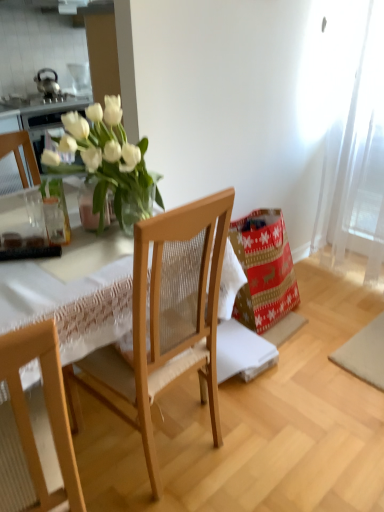
I want to click on clear glass vase at left, so click(55, 212).

Find the location of a particular element. The image size is (384, 512). wooden chair at center is located at coordinates (169, 317).

What is the approximate width of wooden chair at center?

17.62 inches.

Measure the distance between clear glass vase at center and camera.

clear glass vase at center and camera are 4.08 feet apart from each other.

You are a GUI agent. You are given a task and a screenshot of the screen. Output one action in this format:
    pyautogui.click(x=<x>, y=<y>)
    Task: Click on the clear glass vase at left
    
    Given the screenshot: What is the action you would take?
    pyautogui.click(x=55, y=212)

How far apart are wooden chair at center and red and gold paper bag at lower right?

They are 25.68 inches apart.

From a real-world perspective, which is physically below, wooden chair at center or red and gold paper bag at lower right?

From a 3D spatial view, red and gold paper bag at lower right is below.

Locate an element on the screen. Image resolution: width=384 pixels, height=512 pixels. material behind the wooden chair at center is located at coordinates (264, 271).

Are wooden chair at center and red and gold paper bag at lower right making contact?

No.

Who is bigger, clear glass vase at center or wooden chair at center?

With larger size is wooden chair at center.

Visually, is clear glass vase at center positioned to the left or to the right of wooden chair at center?

In the image, clear glass vase at center appears on the left side of wooden chair at center.

Would you consider clear glass vase at center to be distant from clear glass vase at left?

No, clear glass vase at center is not far away from clear glass vase at left.

From a real-world perspective, is clear glass vase at center on clear glass vase at left?

No, from a real-world perspective, clear glass vase at center is not over clear glass vase at left

This screenshot has width=384, height=512. I want to click on glass vase that appears on the left of clear glass vase at center, so click(x=55, y=212).

Does clear glass vase at center have a greater width compared to clear glass vase at left?

Yes, clear glass vase at center is wider than clear glass vase at left.

Would you say wooden chair at center is outside clear glass vase at center?

That's correct, wooden chair at center is outside of clear glass vase at center.

Visually, is wooden chair at center positioned to the left or to the right of clear glass vase at center?

wooden chair at center is positioned on clear glass vase at center's right side.

Which of these two, wooden chair at center or clear glass vase at center, is bigger?

With larger size is wooden chair at center.

Find the location of a particular element. This screenshot has width=384, height=512. glass vase in front of the red and gold paper bag at lower right is located at coordinates (55, 212).

From the picture: From a real-world perspective, relative to red and gold paper bag at lower right, is clear glass vase at left vertically above or below?

clear glass vase at left is above red and gold paper bag at lower right.

Considering the positions of objects clear glass vase at left and red and gold paper bag at lower right in the image provided, who is more to the left, clear glass vase at left or red and gold paper bag at lower right?

clear glass vase at left.

From the image's perspective, which one is positioned higher, clear glass vase at left or red and gold paper bag at lower right?

clear glass vase at left, from the image's perspective.

Would you consider clear glass vase at left to be distant from wooden chair at center?

No, clear glass vase at left is in close proximity to wooden chair at center.

Is clear glass vase at left positioned with its back to wooden chair at center?

Yes, wooden chair at center is at the back of clear glass vase at left.

The image size is (384, 512). Identify the location of chair directly beneath the clear glass vase at left (from a real-world perspective). (169, 317).

Which is more to the left, clear glass vase at left or wooden chair at center?

clear glass vase at left is more to the left.

Would you say clear glass vase at center is part of red and gold paper bag at lower right's contents?

No, clear glass vase at center is not a part of red and gold paper bag at lower right.

Is red and gold paper bag at lower right directly adjacent to clear glass vase at center?

No, red and gold paper bag at lower right is not touching clear glass vase at center.

Is red and gold paper bag at lower right bigger than clear glass vase at center?

Yes, red and gold paper bag at lower right is bigger than clear glass vase at center.

In terms of height, does red and gold paper bag at lower right look taller or shorter compared to clear glass vase at center?

In the image, red and gold paper bag at lower right appears to be taller than clear glass vase at center.

This screenshot has width=384, height=512. In order to click on material on the right of wooden chair at center in this screenshot , I will do `click(264, 271)`.

You are a GUI agent. You are given a task and a screenshot of the screen. Output one action in this format:
    pyautogui.click(x=<x>, y=<y>)
    Task: Click on the chair in front of the clear glass vase at center
    The height and width of the screenshot is (512, 384).
    Given the screenshot: What is the action you would take?
    pyautogui.click(x=169, y=317)

Looking at the image, which one is located closer to clear glass vase at center, clear glass vase at left or wooden chair at center?

Based on the image, clear glass vase at left appears to be nearer to clear glass vase at center.

Looking at the image, which one is located closer to clear glass vase at center, white sheer curtain at right or red and gold paper bag at lower right?

red and gold paper bag at lower right is closer to clear glass vase at center.

Which object lies further to the anchor point red and gold paper bag at lower right, wooden chair at center or clear glass vase at center?

clear glass vase at center.

Which object lies nearer to the anchor point clear glass vase at center, wooden chair at center or white sheer curtain at right?

wooden chair at center.

Considering their positions, is white sheer curtain at right positioned closer to wooden chair at center than red and gold paper bag at lower right?

red and gold paper bag at lower right lies closer to wooden chair at center than the other object.

Considering their positions, is clear glass vase at left positioned further to clear glass vase at center than white sheer curtain at right?

Among the two, white sheer curtain at right is located further to clear glass vase at center.

When comparing their distances from wooden chair at center, does white sheer curtain at right or clear glass vase at center seem further?

white sheer curtain at right lies further to wooden chair at center than the other object.

Which object lies nearer to the anchor point clear glass vase at center, red and gold paper bag at lower right or white sheer curtain at right?

The object closer to clear glass vase at center is red and gold paper bag at lower right.

Locate an element on the screen. vase between clear glass vase at left and red and gold paper bag at lower right is located at coordinates point(88,206).

Image resolution: width=384 pixels, height=512 pixels. I want to click on glass vase positioned between wooden chair at center and red and gold paper bag at lower right from near to far, so click(55, 212).

At what (x,y) coordinates should I click in order to perform the action: click on glass vase between clear glass vase at center and wooden chair at center in the up-down direction. Please return your answer as a coordinate pair (x, y). The width and height of the screenshot is (384, 512). Looking at the image, I should click on (55, 212).

The image size is (384, 512). In order to click on material between clear glass vase at left and white sheer curtain at right in this screenshot , I will do `click(264, 271)`.